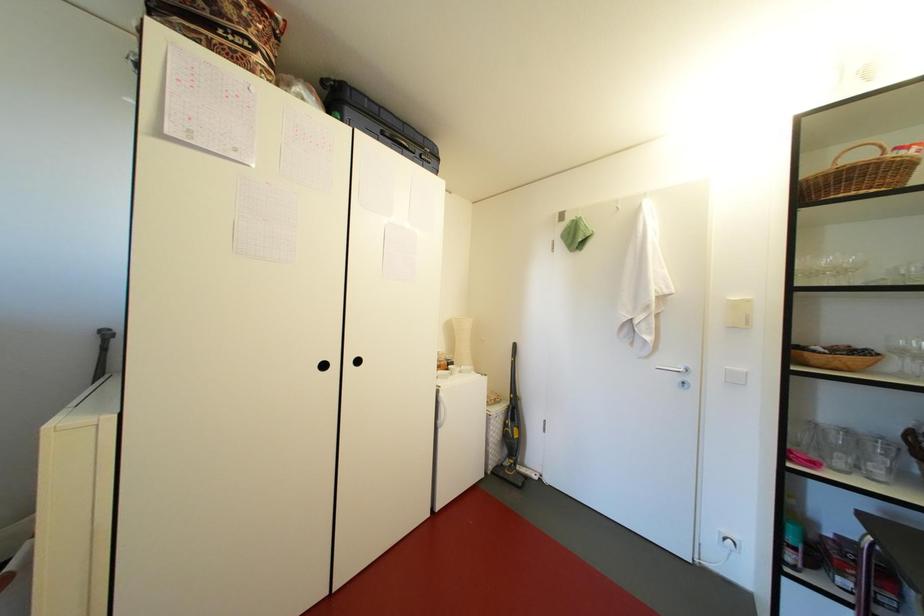
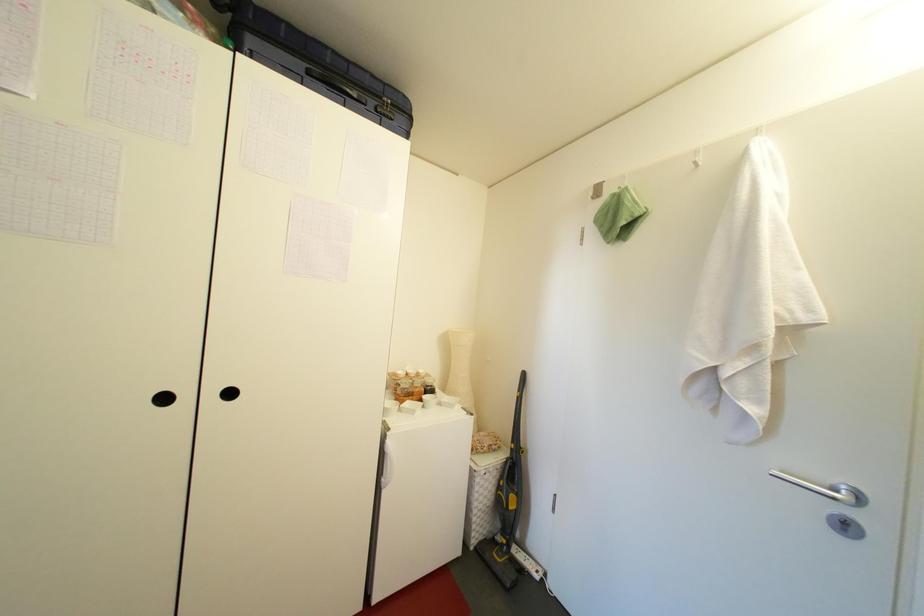
Question: How did the camera likely rotate?

Choices:
 (A) Left
 (B) Right
 (C) Up
 (D) Down

Answer: (A)